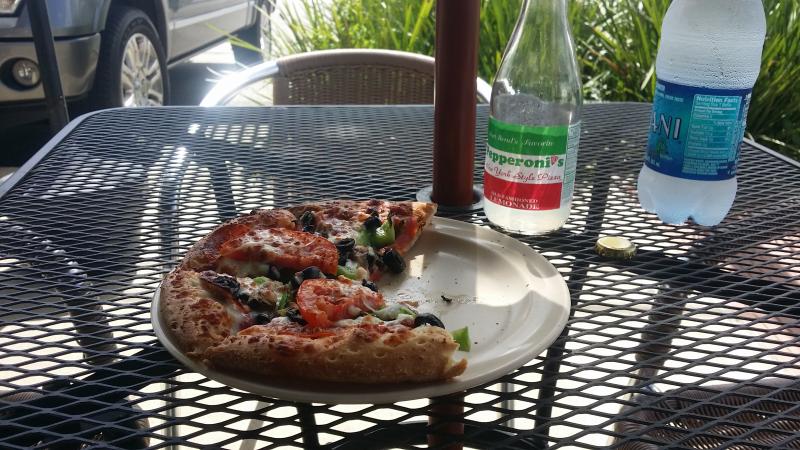
The height and width of the screenshot is (450, 800). What are the coordinates of `table` in the screenshot? It's located at (676, 337).